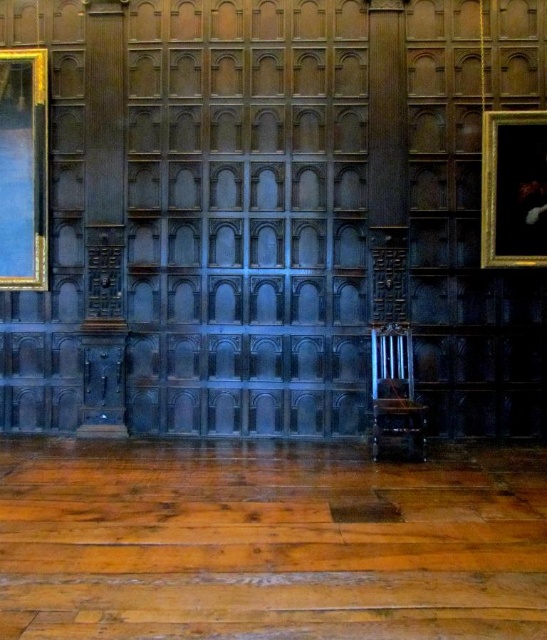
Is point (42, 148) more distant than point (387, 435)?

Yes, it is behind point (387, 435).

Does gold gilded picture frame at left have a smaller size compared to polished dark wood chair at center?

Correct, gold gilded picture frame at left occupies less space than polished dark wood chair at center.

This screenshot has height=640, width=547. What are the coordinates of `gold gilded picture frame at left` in the screenshot? It's located at (24, 170).

Is gold-framed portrait at right above polished dark wood chair at center?

Indeed, gold-framed portrait at right is positioned over polished dark wood chair at center.

Is gold-framed portrait at right shorter than polished dark wood chair at center?

Incorrect, gold-framed portrait at right's height does not fall short of polished dark wood chair at center's.

Image resolution: width=547 pixels, height=640 pixels. Identify the location of gold-framed portrait at right. coord(514,188).

You are a GUI agent. You are given a task and a screenshot of the screen. Output one action in this format:
    pyautogui.click(x=<x>, y=<y>)
    Task: Click on the gold-framed portrait at right
    Image resolution: width=547 pixels, height=640 pixels.
    Given the screenshot: What is the action you would take?
    pyautogui.click(x=514, y=188)

Is gold gilded picture frame at left closer to camera compared to gold-framed portrait at right?

No, gold gilded picture frame at left is behind gold-framed portrait at right.

Measure the distance between gold gilded picture frame at left and camera.

They are 7.63 meters apart.

This screenshot has width=547, height=640. Identify the location of gold gilded picture frame at left. (24, 170).